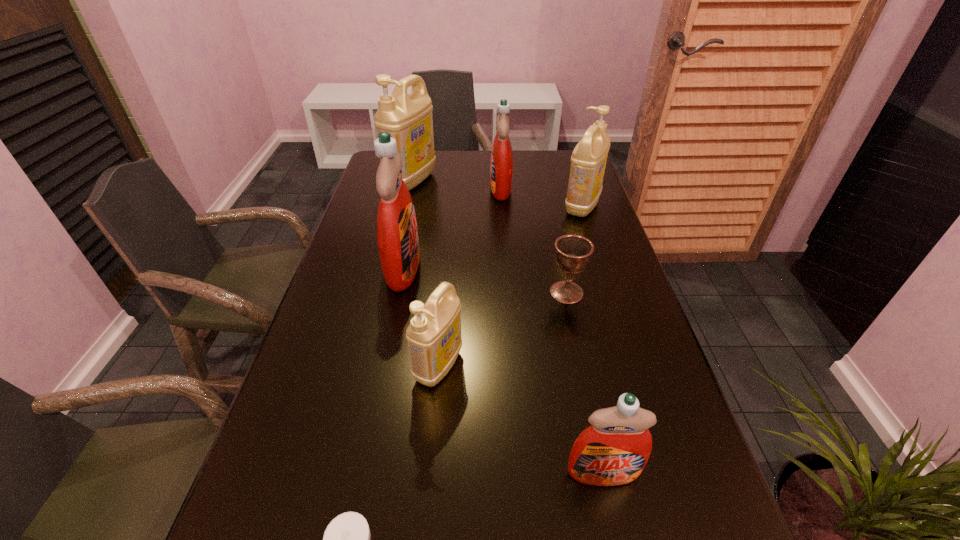
Find the location of `the second shortest object`. the second shortest object is located at coordinates (573, 253).

In order to click on blank area located on the front of the biggest beige detergent in this screenshot , I will do `click(401, 223)`.

Find the location of a particular element. The height and width of the screenshot is (540, 960). vacant space located 0.130m on the front surface of the biggest red detergent is located at coordinates (468, 268).

The width and height of the screenshot is (960, 540). Identify the location of free space located on the front surface of the third detergent from right to left. (472, 189).

Where is `vacant space located on the front surface of the third detergent from right to left`? vacant space located on the front surface of the third detergent from right to left is located at coordinates (398, 189).

Locate an element on the screen. This screenshot has height=540, width=960. vacant region located 0.350m on the front surface of the third detergent from right to left is located at coordinates (387, 189).

I want to click on vacant space located on the back of the second smallest beige detergent, so click(x=565, y=154).

Where is `vacant space located on the front of the second beige detergent from right to left`? This screenshot has height=540, width=960. vacant space located on the front of the second beige detergent from right to left is located at coordinates (431, 454).

At what (x,y) coordinates should I click in order to perform the action: click on free space located 0.180m on the back of the seventh tallest object. Please return your answer as a coordinate pair (x, y). Image resolution: width=960 pixels, height=540 pixels. Looking at the image, I should click on (555, 240).

The height and width of the screenshot is (540, 960). I want to click on chalice that is at the right edge, so click(573, 253).